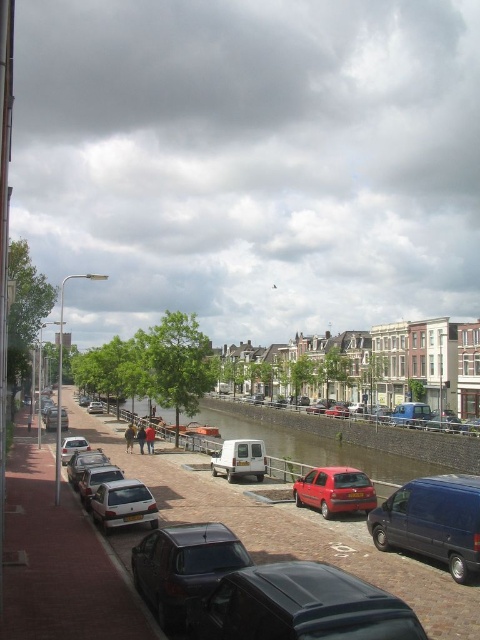
Question: Which of these objects is positioned farthest from the silver metallic hatchback at center-left?

Choices:
 (A) silver metallic van at lower left
 (B) shiny black car at lower center
 (C) silver metallic hatchback at lower left
 (D) silver metallic hatchback at center

Answer: (D)

Question: Is matte silver hatchback at center thinner than silver metallic van at lower left?

Choices:
 (A) yes
 (B) no

Answer: (B)

Question: Can you confirm if brick pavement at lower left is thinner than dark blue van at right?

Choices:
 (A) no
 (B) yes

Answer: (A)

Question: Is silver metallic van at lower left closer to camera compared to matte silver car at center?

Choices:
 (A) no
 (B) yes

Answer: (B)

Question: Which object is positioned closest to the silver metallic hatchback at lower left?

Choices:
 (A) brick pavement at lower left
 (B) matte silver car at center
 (C) white matte van at center
 (D) smooth concrete waterway at center

Answer: (A)

Question: Among these objects, which one is farthest from the camera?

Choices:
 (A) silver metallic hatchback at center-left
 (B) silver metallic van at lower left

Answer: (B)